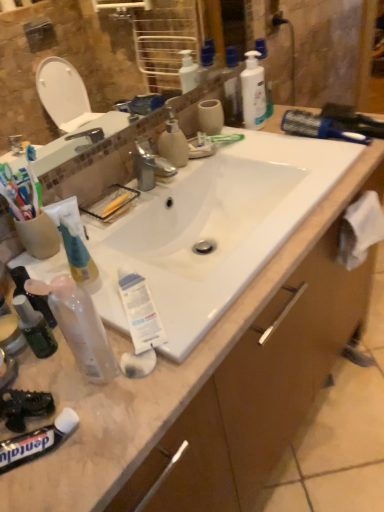
Locate an element on the screen. The height and width of the screenshot is (512, 384). free spot to the left of white matte tube at center, the 2th toothpaste in the top-to-bottom sequence is located at coordinates (71, 348).